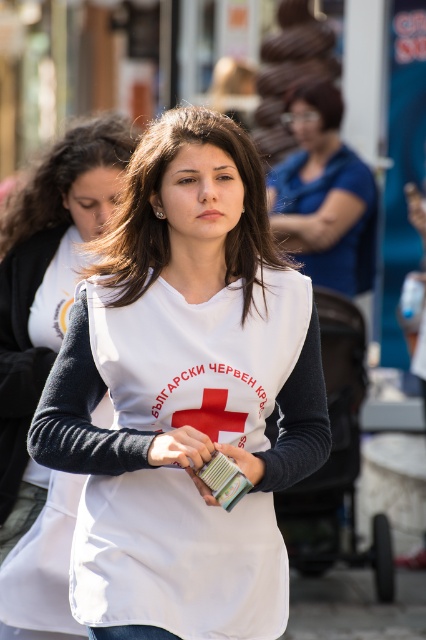
Is white matte vest at left positioned before denim at center?

No, white matte vest at left is behind denim at center.

What do you see at coordinates (46, 353) in the screenshot? I see `white matte vest at left` at bounding box center [46, 353].

Which is in front, point (69, 148) or point (134, 637)?

Point (134, 637)

Find the location of a particular element. This screenshot has height=640, width=426. white matte vest at left is located at coordinates (46, 353).

Is white matte vest at center to the right of white matte vest at left from the viewer's perspective?

Indeed, white matte vest at center is positioned on the right side of white matte vest at left.

Can you confirm if white matte vest at center is smaller than white matte vest at left?

No.

Locate an element on the screen. Image resolution: width=426 pixels, height=640 pixels. white matte vest at center is located at coordinates (184, 392).

Can you confirm if white matte vest at left is positioned to the right of blue fabric shirt at upper center?

No, white matte vest at left is not to the right of blue fabric shirt at upper center.

Who is positioned more to the left, white matte vest at left or blue fabric shirt at upper center?

white matte vest at left is more to the left.

Between point (49, 614) and point (293, 221), which one is positioned behind?

Positioned behind is point (293, 221).

Where is `white matte vest at left`? The width and height of the screenshot is (426, 640). white matte vest at left is located at coordinates (46, 353).